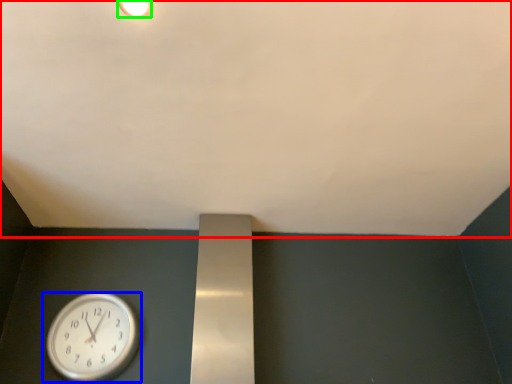
Question: Based on their relative distances, which object is farther from backdrop (highlighted by a red box)? Choose from wall clock (highlighted by a blue box) and light fixture (highlighted by a green box).

Choices:
 (A) wall clock
 (B) light fixture

Answer: (A)